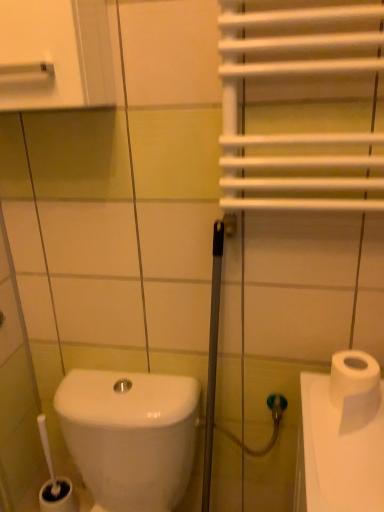
Measure the distance between point [110,490] and camera.

Answer: Point [110,490] is 1.12 meters away from camera.

The width and height of the screenshot is (384, 512). I want to click on white glossy toilet at lower left, so click(130, 435).

Is white matte toilet paper at right touching white glossy toilet at lower left?

No, white matte toilet paper at right is not next to white glossy toilet at lower left.

Identify the location of toilet on the left of white matte toilet paper at right. (130, 435).

Based on the photo, is white matte toilet paper at right closer to the viewer compared to white glossy toilet at lower left?

That is False.

From the image's perspective, which one is positioned higher, white matte toilet paper at right or white glossy toilet at lower left?

white matte toilet paper at right, from the image's perspective.

Does white glossy medicine cabinet at upper left have a larger size compared to white matte toilet paper at right?

Indeed, white glossy medicine cabinet at upper left has a larger size compared to white matte toilet paper at right.

Locate an element on the screen. medicine cabinet above the white matte toilet paper at right (from the image's perspective) is located at coordinates (55, 54).

Which is more to the right, white matte toilet paper at right or white glossy medicine cabinet at upper left?

Positioned to the right is white matte toilet paper at right.

Considering the positions of objects white matte toilet paper at right and white glossy medicine cabinet at upper left in the image provided, who is in front, white matte toilet paper at right or white glossy medicine cabinet at upper left?

white glossy medicine cabinet at upper left.

Is white glossy medicine cabinet at upper left completely or partially inside white matte toilet paper at right?

No.

Considering the relative sizes of white matte toilet paper at right and white glossy medicine cabinet at upper left in the image provided, is white matte toilet paper at right thinner than white glossy medicine cabinet at upper left?

Yes.

From the image's perspective, is white glossy toilet at lower left on top of white glossy medicine cabinet at upper left?

No.

From a real-world perspective, is white glossy toilet at lower left located beneath white glossy medicine cabinet at upper left?

Yes, from a real-world perspective, white glossy toilet at lower left is below white glossy medicine cabinet at upper left.

Is white glossy toilet at lower left located outside white glossy medicine cabinet at upper left?

white glossy toilet at lower left is positioned outside white glossy medicine cabinet at upper left.

Where is `medicine cabinet located in front of the white glossy toilet at lower left`? This screenshot has height=512, width=384. medicine cabinet located in front of the white glossy toilet at lower left is located at coordinates (55, 54).

Is white glossy medicine cabinet at upper left inside or outside of white glossy toilet at lower left?

white glossy medicine cabinet at upper left is not inside white glossy toilet at lower left, it's outside.

Which object is closer to the camera, white glossy medicine cabinet at upper left or white glossy toilet at lower left?

white glossy medicine cabinet at upper left is closer to the camera.

Where is `medicine cabinet on the left of white glossy toilet at lower left`? medicine cabinet on the left of white glossy toilet at lower left is located at coordinates [x=55, y=54].

Is white glossy medicine cabinet at upper left to the right of white glossy toilet at lower left from the viewer's perspective?

No, white glossy medicine cabinet at upper left is not to the right of white glossy toilet at lower left.

Considering the positions of objects white glossy toilet at lower left and white matte toilet paper at right in the image provided, who is behind, white glossy toilet at lower left or white matte toilet paper at right?

white matte toilet paper at right is further from the camera.

From the image's perspective, between white glossy toilet at lower left and white matte toilet paper at right, which one is located above?

white matte toilet paper at right appears higher in the image.

Considering the relative sizes of white glossy toilet at lower left and white matte toilet paper at right in the image provided, is white glossy toilet at lower left thinner than white matte toilet paper at right?

No, white glossy toilet at lower left is not thinner than white matte toilet paper at right.

Where is `toilet below the white matte toilet paper at right (from the image's perspective)`? The image size is (384, 512). toilet below the white matte toilet paper at right (from the image's perspective) is located at coordinates (130, 435).

Identify the location of toilet paper behind the white glossy medicine cabinet at upper left. The height and width of the screenshot is (512, 384). (355, 388).

From the image, which object appears to be farther from white glossy toilet at lower left, white matte toilet paper at right or white glossy medicine cabinet at upper left?

white glossy medicine cabinet at upper left.

Looking at the image, which one is located further to white matte toilet paper at right, white glossy toilet at lower left or white glossy medicine cabinet at upper left?

Among the two, white glossy medicine cabinet at upper left is located further to white matte toilet paper at right.

Looking at the image, which one is located closer to white glossy medicine cabinet at upper left, white glossy toilet at lower left or white matte toilet paper at right?

white matte toilet paper at right.

In the scene shown: Based on their spatial positions, is white glossy medicine cabinet at upper left or white glossy toilet at lower left further from white matte toilet paper at right?

white glossy medicine cabinet at upper left.

Based on their spatial positions, is white glossy medicine cabinet at upper left or white matte toilet paper at right closer to white glossy toilet at lower left?

white matte toilet paper at right lies closer to white glossy toilet at lower left than the other object.

When comparing their distances from white glossy medicine cabinet at upper left, does white matte toilet paper at right or white glossy toilet at lower left seem further?

Based on the image, white glossy toilet at lower left appears to be further to white glossy medicine cabinet at upper left.

Locate an element on the screen. This screenshot has height=512, width=384. toilet paper between white glossy medicine cabinet at upper left and white glossy toilet at lower left from top to bottom is located at coordinates (355, 388).